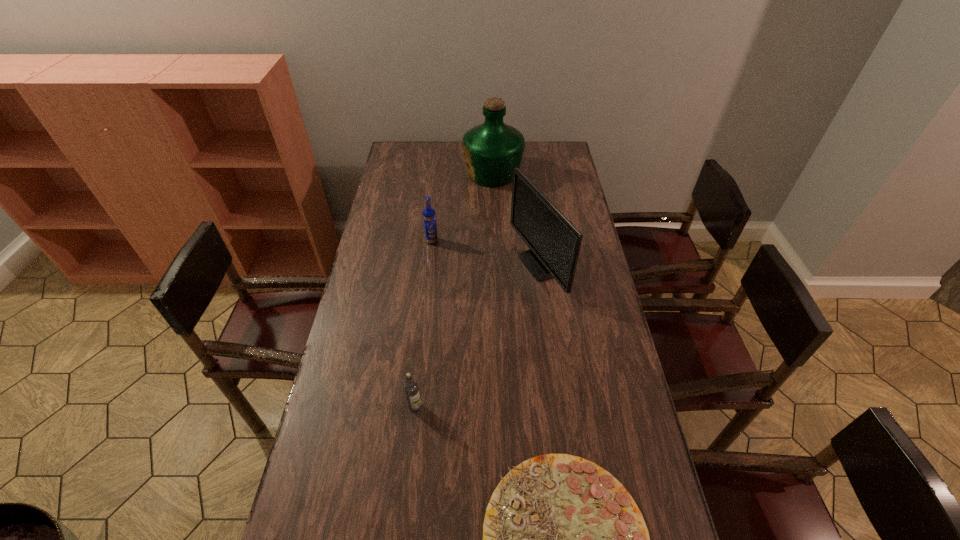
At what (x,y) coordinates should I click in order to perform the action: click on vacant region located on the front-facing side of the computer monitor. Please return your answer as a coordinate pair (x, y). This screenshot has width=960, height=540. Looking at the image, I should click on click(429, 265).

Identify the location of vacant point located on the front-facing side of the computer monitor. This screenshot has width=960, height=540. (416, 265).

Identify the location of free space located 0.240m on the back of the taller vodka. Image resolution: width=960 pixels, height=540 pixels. (437, 201).

Locate an element on the screen. free space located 0.110m on the label of the shorter vodka is located at coordinates (410, 452).

Locate an element on the screen. The height and width of the screenshot is (540, 960). object situated at the far edge is located at coordinates (492, 150).

At what (x,y) coordinates should I click in order to perform the action: click on object located at the right edge. Please return your answer as a coordinate pair (x, y). Looking at the image, I should click on (554, 243).

In order to click on blank space at the far edge in this screenshot , I will do `click(449, 151)`.

Find the location of `vacant space at the left edge of the desktop`. vacant space at the left edge of the desktop is located at coordinates (386, 192).

The image size is (960, 540). In order to click on free space at the right edge in this screenshot , I will do `click(588, 294)`.

Where is `vacant space at the far right corner of the desktop`? vacant space at the far right corner of the desktop is located at coordinates (561, 152).